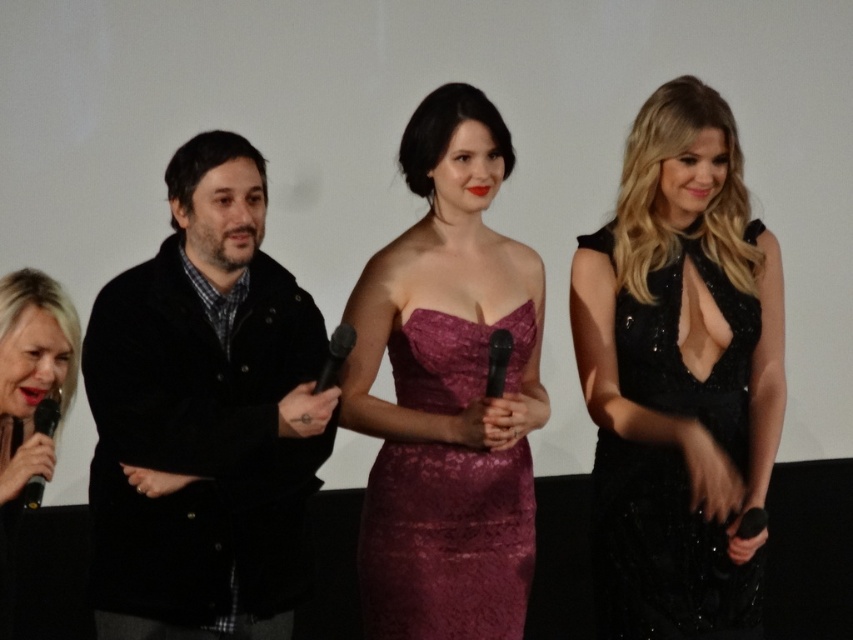
Question: Which of the following is the closest to the observer?

Choices:
 (A) blonde hair at left
 (B) black matte microphone at lower left
 (C) black woolen coat at left

Answer: (B)

Question: Is black sequined dress at right below blonde hair at left?

Choices:
 (A) no
 (B) yes

Answer: (A)

Question: Which point is closer to the camera?

Choices:
 (A) (511, 349)
 (B) (334, 376)
 (C) (62, 342)
 (D) (361, 525)

Answer: (B)

Question: Which of the following is the closest to the observer?

Choices:
 (A) black sequined dress at right
 (B) black matte microphone at lower left

Answer: (B)

Question: Does blonde hair at left appear on the left side of black matte microphone at lower left?

Choices:
 (A) yes
 (B) no

Answer: (A)

Question: Does burgundy lace dress at center appear on the right side of black metallic microphone at center?

Choices:
 (A) yes
 (B) no

Answer: (B)